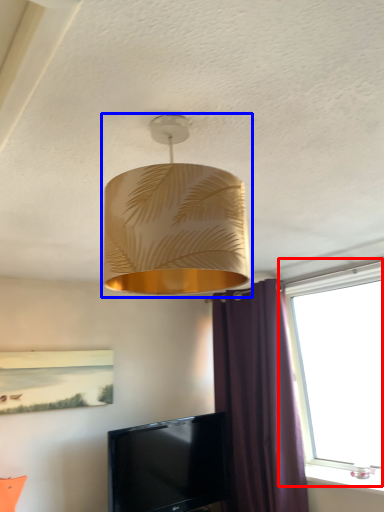
Question: Which of the following is the farthest to the observer, window (highlighted by a red box) or lamp (highlighted by a blue box)?

Choices:
 (A) window
 (B) lamp

Answer: (A)